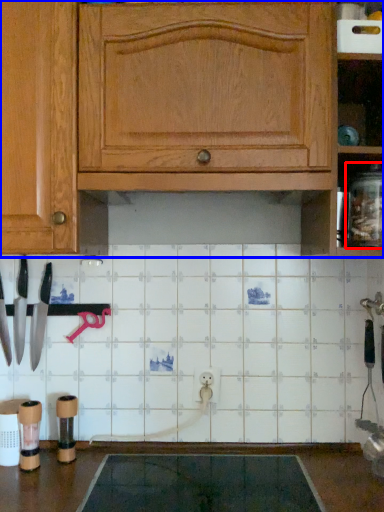
Question: Which point is closer to the camera, glass jar (highlighted by a red box) or cabinetry (highlighted by a blue box)?

Choices:
 (A) glass jar
 (B) cabinetry

Answer: (B)